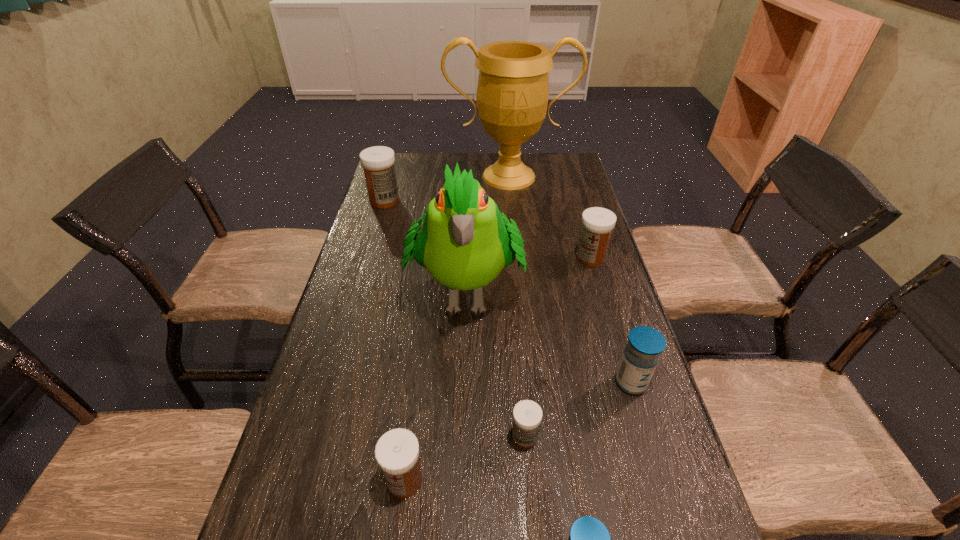
Where is `trophy`? trophy is located at coordinates (512, 95).

Find the location of `green parakeet`. green parakeet is located at coordinates (465, 242).

This screenshot has width=960, height=540. I want to click on the leftmost white medicine, so click(378, 162).

Find the location of a particular element. the farthest white medicine is located at coordinates (378, 162).

Locate an element on the screen. The height and width of the screenshot is (540, 960). the bigger blue medicine is located at coordinates (645, 344).

Image resolution: width=960 pixels, height=540 pixels. I want to click on the farther blue medicine, so [x=645, y=344].

At what (x,y) coordinates should I click in order to perform the action: click on the second farthest medicine. Please return your answer as a coordinate pair (x, y). Looking at the image, I should click on (597, 223).

Locate an element on the screen. Image resolution: width=960 pixels, height=540 pixels. the rightmost white medicine is located at coordinates (597, 223).

At what (x,y) coordinates should I click in order to perform the action: click on the fifth farthest medicine. Please return your answer as a coordinate pair (x, y). The height and width of the screenshot is (540, 960). Looking at the image, I should click on (397, 451).

Where is `the second white medicine from left to right`? This screenshot has height=540, width=960. the second white medicine from left to right is located at coordinates (397, 451).